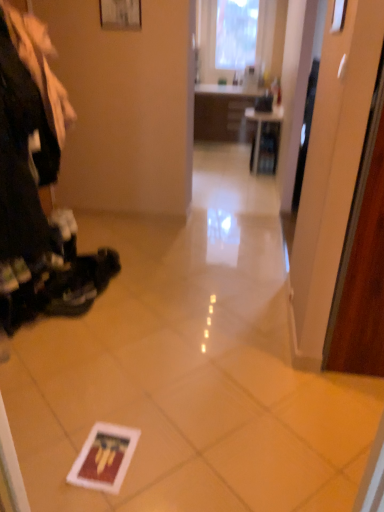
This screenshot has width=384, height=512. What do you see at coordinates (261, 125) in the screenshot?
I see `matte black shelf at center` at bounding box center [261, 125].

Locate an element on the screen. matte black shelf at center is located at coordinates (261, 125).

Looking at this image, what is the approximate width of matte white picture frame at upper center?

It is 3.94 centimeters.

The image size is (384, 512). Describe the element at coordinates (120, 14) in the screenshot. I see `matte white picture frame at upper center` at that location.

Find the location of a particular element. The width and height of the screenshot is (384, 512). matte white picture frame at upper center is located at coordinates point(120,14).

Identify the location of matte black shelf at center. This screenshot has height=512, width=384. (261, 125).

Is matte black shelf at center at the left side of matte white picture frame at upper center?

Incorrect, matte black shelf at center is not on the left side of matte white picture frame at upper center.

Which object is closer to the camera taking this photo, matte black shelf at center or matte white picture frame at upper center?

matte white picture frame at upper center is in front.

Between point (258, 130) and point (108, 26), which one is positioned in front?

The point (108, 26) is closer to the camera.

From the image's perspective, is matte black shelf at center located above or below matte white picture frame at upper center?

matte black shelf at center is below matte white picture frame at upper center.

From a real-world perspective, between matte black shelf at center and matte white picture frame at upper center, who is vertically lower?

matte black shelf at center is physically lower.

Which of these two, matte black shelf at center or matte white picture frame at upper center, is thinner?

matte white picture frame at upper center is thinner.

Who is taller, matte black shelf at center or matte white picture frame at upper center?

Standing taller between the two is matte black shelf at center.

Does matte black shelf at center have a smaller size compared to matte white picture frame at upper center?

No, matte black shelf at center is not smaller than matte white picture frame at upper center.

Can we say matte black shelf at center lies outside matte white picture frame at upper center?

Indeed, matte black shelf at center is completely outside matte white picture frame at upper center.

Based on the photo, would you consider matte black shelf at center to be distant from matte white picture frame at upper center?

That's right, there is a large distance between matte black shelf at center and matte white picture frame at upper center.

Is matte black shelf at center aimed at matte white picture frame at upper center?

No.

Where is `picture frame above the matte black shelf at center (from the image's perspective)`? The height and width of the screenshot is (512, 384). picture frame above the matte black shelf at center (from the image's perspective) is located at coordinates (120, 14).

Is matte white picture frame at upper center at the right side of matte black shelf at center?

No, matte white picture frame at upper center is not to the right of matte black shelf at center.

Which object is more forward, matte white picture frame at upper center or matte black shelf at center?

Positioned in front is matte white picture frame at upper center.

Does point (118, 23) appear closer or farther from the camera than point (275, 115)?

Point (118, 23).

From the image's perspective, is matte white picture frame at upper center positioned above or below matte black shelf at center?

matte white picture frame at upper center is above matte black shelf at center.

From a real-world perspective, is matte white picture frame at upper center positioned above or below matte black shelf at center?

matte white picture frame at upper center is situated higher than matte black shelf at center in the real world.

Is matte white picture frame at upper center wider than matte black shelf at center?

Incorrect, the width of matte white picture frame at upper center does not surpass that of matte black shelf at center.

Is matte white picture frame at upper center shorter than matte black shelf at center?

Yes, matte white picture frame at upper center is shorter than matte black shelf at center.

Is matte white picture frame at upper center smaller than matte black shelf at center?

Indeed, matte white picture frame at upper center has a smaller size compared to matte black shelf at center.

Can we say matte white picture frame at upper center lies outside matte black shelf at center?

Yes, matte white picture frame at upper center is not within matte black shelf at center.

Would you say matte white picture frame at upper center is a long distance from matte black shelf at center?

Yes.

Could you tell me if matte white picture frame at upper center is turned towards matte black shelf at center?

No.

Where is `picture frame on the left of matte black shelf at center`? Image resolution: width=384 pixels, height=512 pixels. picture frame on the left of matte black shelf at center is located at coordinates (120, 14).

What are the coordinates of `table beneath the matte white picture frame at upper center (from a real-world perspective)` in the screenshot? It's located at (261, 125).

At what (x,y) coordinates should I click in order to perform the action: click on picture frame in front of the matte black shelf at center. Please return your answer as a coordinate pair (x, y). This screenshot has width=384, height=512. Looking at the image, I should click on (120, 14).